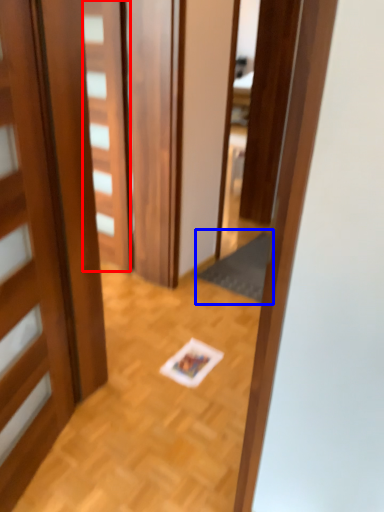
Question: Which object appears farthest to the camera in this image, door (highlighted by a red box) or doormat (highlighted by a blue box)?

Choices:
 (A) door
 (B) doormat

Answer: (B)